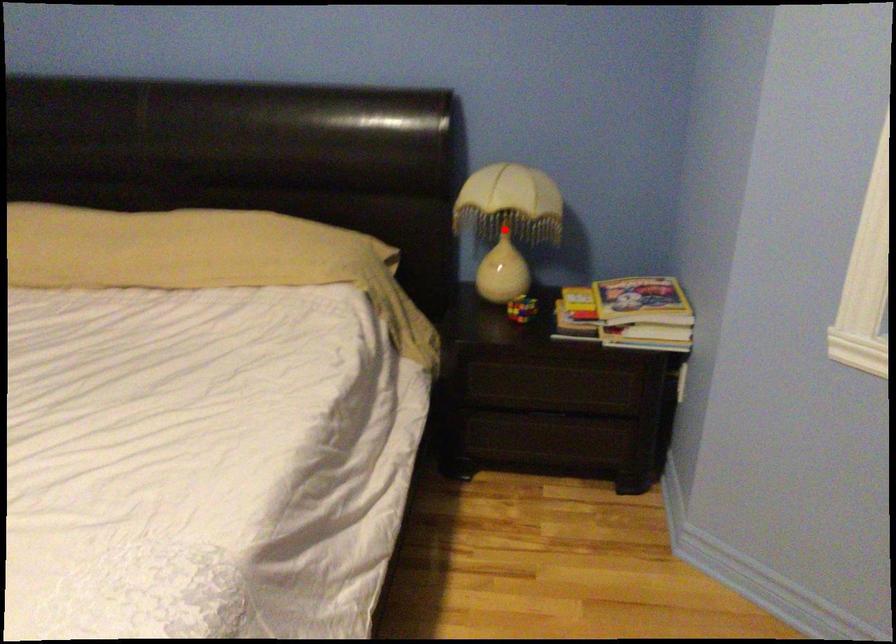
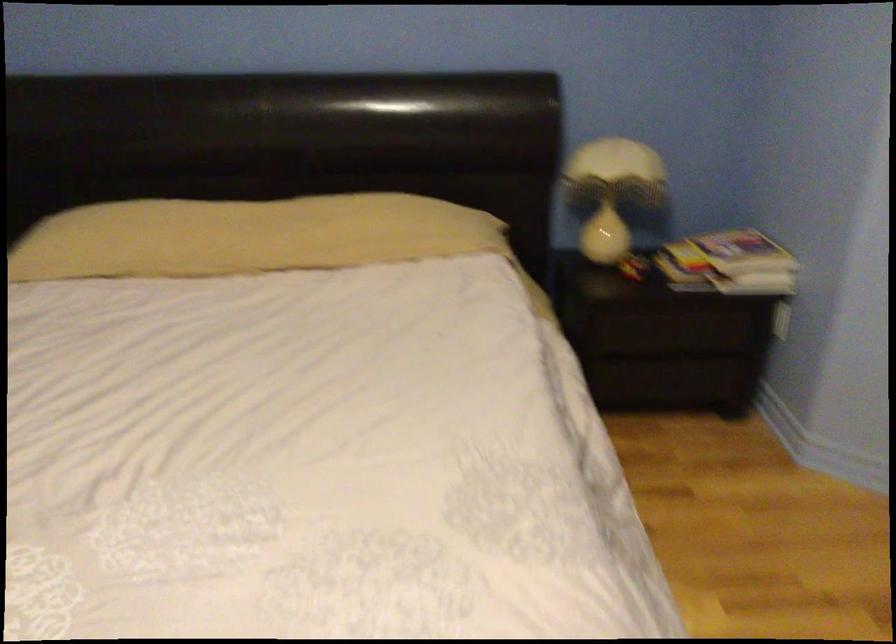
Question: I am providing you with two images of the same scene from different viewpoints. A red point is shown in image1. For the corresponding object point in image2, is it positioned nearer or farther from the camera?

Choices:
 (A) Nearer
 (B) Farther

Answer: (B)